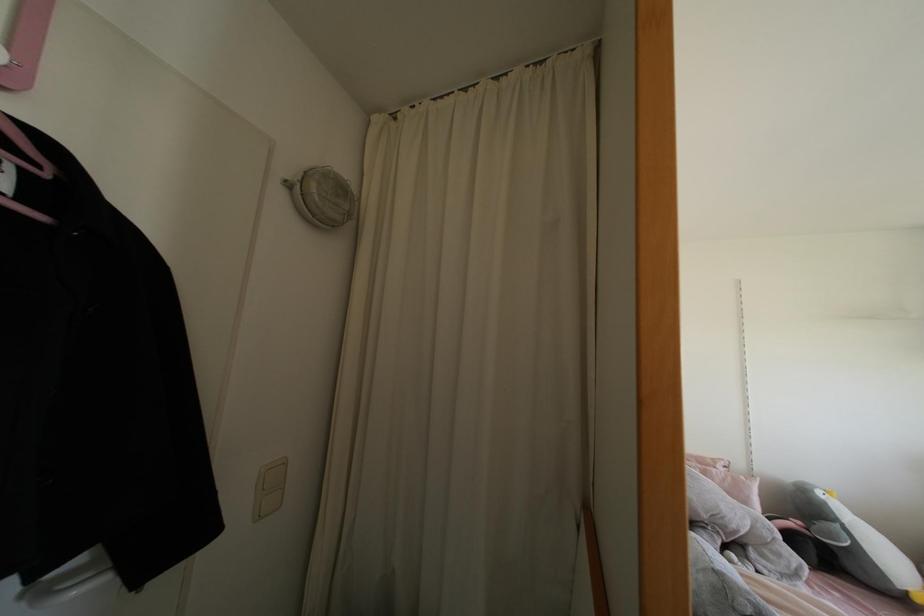
The width and height of the screenshot is (924, 616). What do you see at coordinates (854, 541) in the screenshot? I see `the penguin stuffed animal` at bounding box center [854, 541].